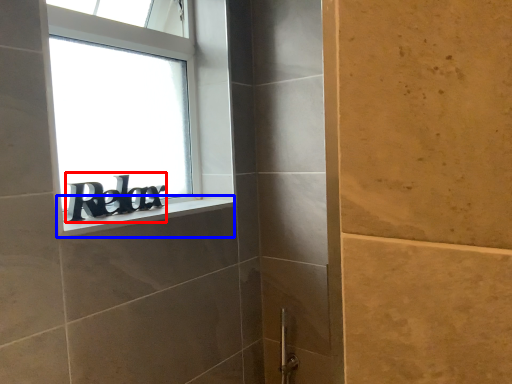
Question: Among these objects, which one is nearest to the camera, writing (highlighted by a red box) or window sill (highlighted by a blue box)?

Choices:
 (A) writing
 (B) window sill

Answer: (B)